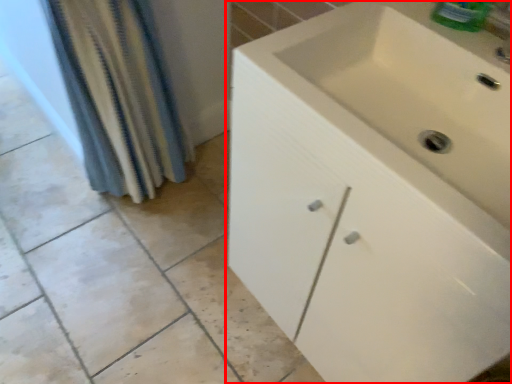
Question: Considering the relative positions of bathroom cabinet (annotated by the red box) and shower curtain in the image provided, where is bathroom cabinet (annotated by the red box) located with respect to the staircase?

Choices:
 (A) left
 (B) right

Answer: (B)